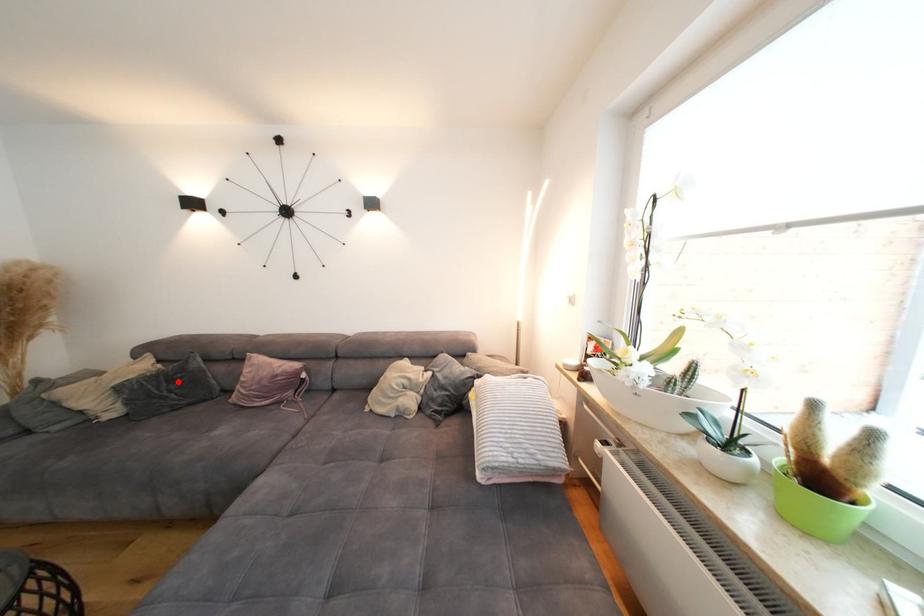
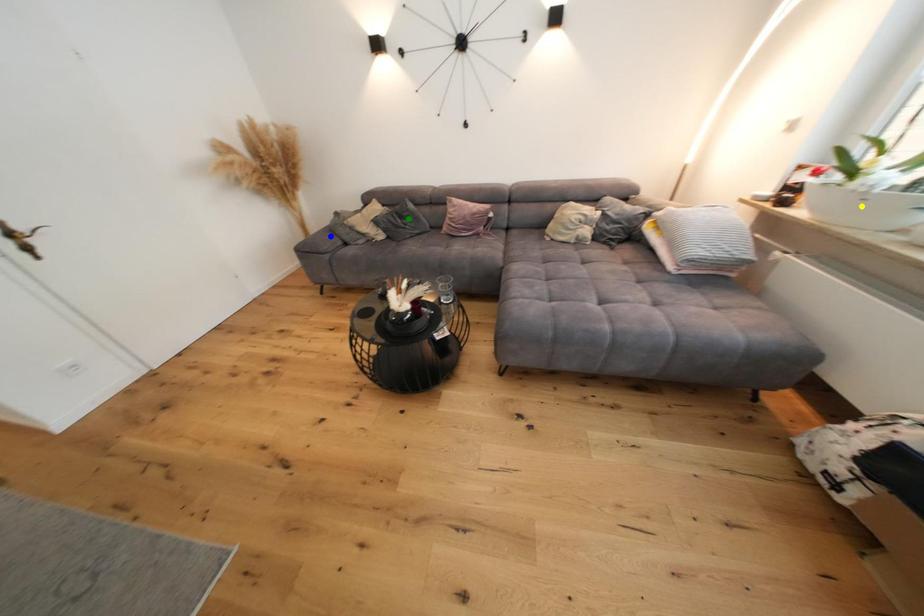
Question: I am providing you with two images of the same scene from different viewpoints. A red point is marked on the first image. You are given multiple points on the second image. Which point in image 2 represents the same 3d spot as the red point in image 1?

Choices:
 (A) blue point
 (B) yellow point
 (C) green point

Answer: (C)